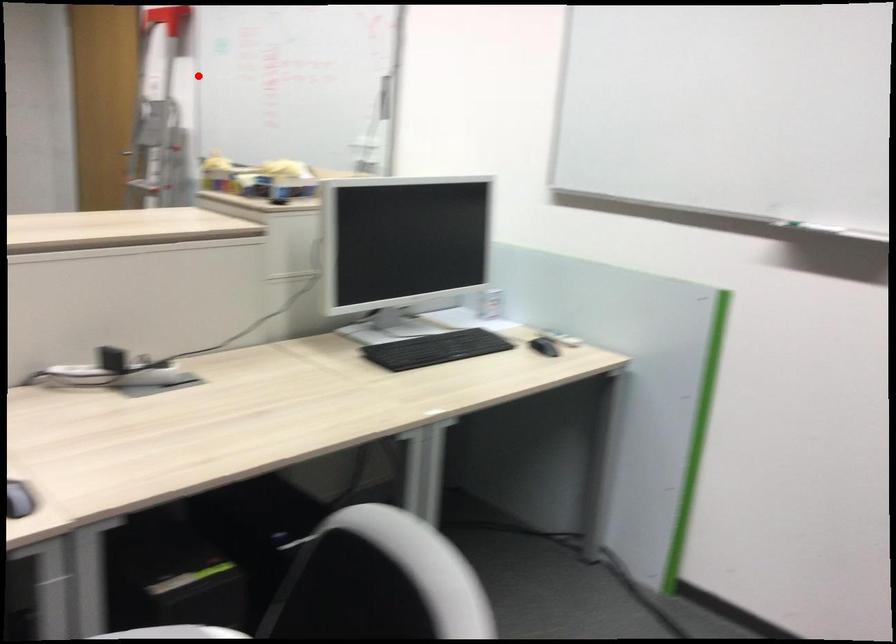
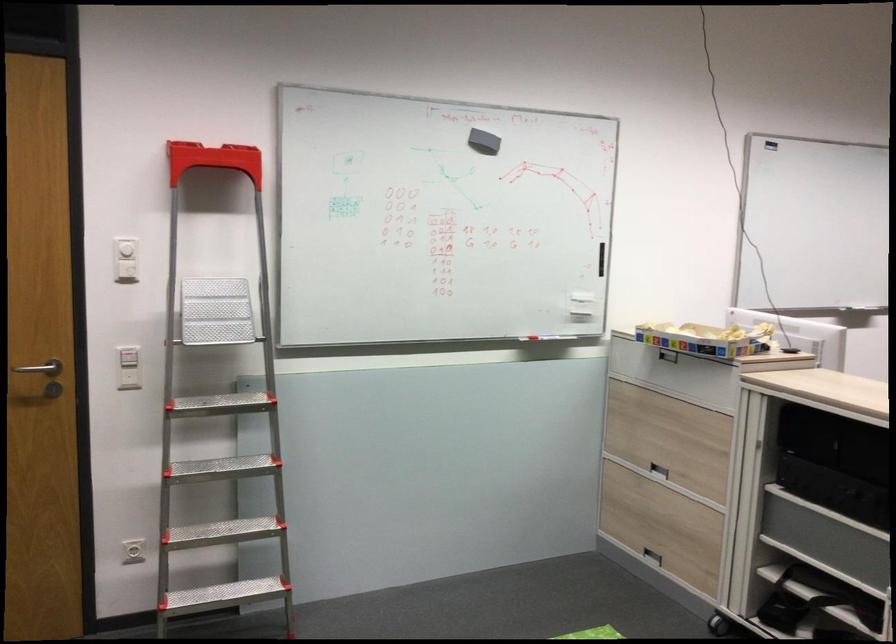
Question: I am providing you with two images of the same scene from different viewpoints. Given a red point in image1, look at the same physical point in image2. Is it:

Choices:
 (A) Closer to the viewpoint
 (B) Farther from the viewpoint

Answer: (A)